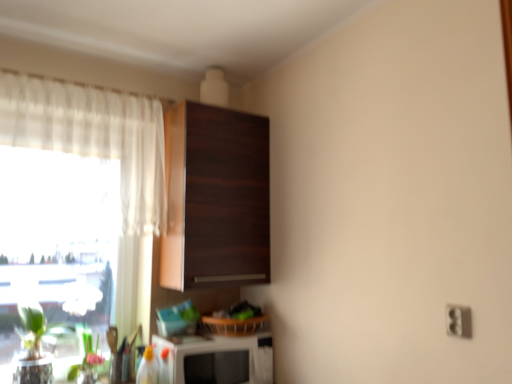
Question: Considering the positions of dark wood cabinet at upper center and white glossy microwave at lower center in the image, is dark wood cabinet at upper center taller or shorter than white glossy microwave at lower center?

Choices:
 (A) tall
 (B) short

Answer: (A)

Question: From a real-world perspective, is dark wood cabinet at upper center physically located above or below white glossy microwave at lower center?

Choices:
 (A) above
 (B) below

Answer: (A)

Question: Based on their relative distances, which object is farther from the white sheer curtain at left?

Choices:
 (A) green matte plant at lower left
 (B) white glossy microwave at lower center
 (C) dark wood cabinet at upper center
 (D) white plastic electric outlet at lower right

Answer: (D)

Question: Which object is the farthest from the white plastic electric outlet at lower right?

Choices:
 (A) white sheer curtain at left
 (B) green matte plant at lower left
 (C) dark wood cabinet at upper center
 (D) white glossy microwave at lower center

Answer: (A)